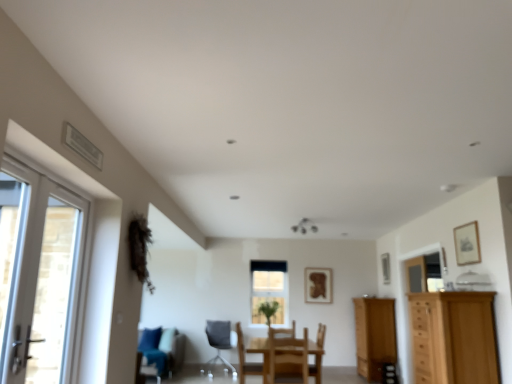
What do you see at coordinates (269, 290) in the screenshot? This screenshot has height=384, width=512. I see `clear glass window at center` at bounding box center [269, 290].

Where is `green leafy plant at center`? green leafy plant at center is located at coordinates (268, 310).

Based on the photo, measure the distance between wooden chair at center, the 3th chair in the back-to-front sequence, and camera.

They are 6.20 meters apart.

You are a GUI agent. You are given a task and a screenshot of the screen. Output one action in this format:
    pyautogui.click(x=<x>, y=<y>)
    Task: Click on the gray fabric chair at center, the first chair viewed from the left
    The image size is (512, 384).
    Given the screenshot: What is the action you would take?
    point(219,341)

Where is `wooden framed picture at center, the 3th picture frame viewed from the right`? This screenshot has height=384, width=512. wooden framed picture at center, the 3th picture frame viewed from the right is located at coordinates (318, 285).

Visually, is light brown wood cabinet at right, which appears as the second cabinetry when viewed from the top, positioned to the left or to the right of wooden picture frame at right, which is the 2th picture frame in front-to-back order?

Clearly, light brown wood cabinet at right, which appears as the second cabinetry when viewed from the top, is on the left of wooden picture frame at right, which is the 2th picture frame in front-to-back order, in the image.

Considering the relative sizes of light brown wood cabinet at right, the first cabinetry viewed from the back, and wooden picture frame at right, the second picture frame positioned from the bottom, in the image provided, is light brown wood cabinet at right, the first cabinetry viewed from the back, taller than wooden picture frame at right, the second picture frame positioned from the bottom,?

Correct, light brown wood cabinet at right, the first cabinetry viewed from the back, is much taller as wooden picture frame at right, the second picture frame positioned from the bottom.

Image resolution: width=512 pixels, height=384 pixels. I want to click on the 2nd cabinetry directly beneath the wooden picture frame at right, which is the 2th picture frame in front-to-back order (from a real-world perspective), so click(374, 336).

From the image's perspective, is light brown wood cabinet at right, acting as the 1th cabinetry starting from the bottom, under wooden picture frame at right, the second picture frame in the top-to-bottom sequence?

Yes, from the image's perspective, light brown wood cabinet at right, acting as the 1th cabinetry starting from the bottom, is below wooden picture frame at right, the second picture frame in the top-to-bottom sequence.

Can you tell me how much wooden chair at center, arranged as the first chair when viewed from the right, and white glossy door at left, the second door positioned from the right, differ in facing direction?

The facing directions of wooden chair at center, arranged as the first chair when viewed from the right, and white glossy door at left, the second door positioned from the right, are 90.8 degrees apart.

Does wooden chair at center, the 3th chair when ordered from left to right, have a greater height compared to white glossy door at left, arranged as the first door when viewed from the top?

In fact, wooden chair at center, the 3th chair when ordered from left to right, may be shorter than white glossy door at left, arranged as the first door when viewed from the top.

Is wooden chair at center, the 3th chair in the back-to-front sequence, next to white glossy door at left, marked as the 1th door in a left-to-right arrangement, and touching it?

No.

Which object is positioned more to the left, wooden chair at center, the 3th chair in the back-to-front sequence, or white glossy door at left, marked as the 2th door in a back-to-front arrangement?

From the viewer's perspective, white glossy door at left, marked as the 2th door in a back-to-front arrangement, appears more on the left side.

Considering the sizes of wooden cabinet at right, placed as the second door when sorted from left to right, and wooden chair at center, which is the second chair in right-to-left order, in the image, is wooden cabinet at right, placed as the second door when sorted from left to right, bigger or smaller than wooden chair at center, which is the second chair in right-to-left order,?

Considering their sizes, wooden cabinet at right, placed as the second door when sorted from left to right, takes up less space than wooden chair at center, which is the second chair in right-to-left order.

Would you say wooden cabinet at right, placed as the 2th door when sorted from front to back, is to the left or to the right of wooden chair at center, which is the 2th chair from front to back, in the picture?

Based on their positions, wooden cabinet at right, placed as the 2th door when sorted from front to back, is located to the right of wooden chair at center, which is the 2th chair from front to back.

Who is shorter, wooden cabinet at right, placed as the 2th door when sorted from front to back, or wooden chair at center, which is the 2th chair from front to back?

Standing shorter between the two is wooden chair at center, which is the 2th chair from front to back.

Is wooden chair at center, the first chair viewed from the front, at the back of wooden framed picture at center, placed as the 1th picture frame when sorted from bottom to top?

That's not correct — wooden framed picture at center, placed as the 1th picture frame when sorted from bottom to top, is not looking away from wooden chair at center, the first chair viewed from the front.

From the image's perspective, which object appears higher, wooden framed picture at center, which ranks as the first picture frame in left-to-right order, or wooden chair at center, the 3th chair when ordered from left to right?

wooden framed picture at center, which ranks as the first picture frame in left-to-right order.

Is wooden framed picture at center, the 3th picture frame from the front, to the left or to the right of wooden chair at center, the 3th chair when ordered from left to right, in the image?

Clearly, wooden framed picture at center, the 3th picture frame from the front, is on the right of wooden chair at center, the 3th chair when ordered from left to right, in the image.

From the picture: Considering the positions of objects clear glass window at center and wooden chair at center, the first chair viewed from the front, in the image provided, who is in front, clear glass window at center or wooden chair at center, the first chair viewed from the front,?

wooden chair at center, the first chair viewed from the front, is closer to the camera.

Does clear glass window at center have a smaller size compared to wooden chair at center, arranged as the first chair when viewed from the right?

Correct, clear glass window at center occupies less space than wooden chair at center, arranged as the first chair when viewed from the right.

Is clear glass window at center oriented towards wooden chair at center, the 3th chair when ordered from left to right?

Yes, clear glass window at center is turned towards wooden chair at center, the 3th chair when ordered from left to right.

From a real-world perspective, relative to wooden chair at center, the first chair viewed from the front, is clear glass window at center vertically above or below?

clear glass window at center is situated higher than wooden chair at center, the first chair viewed from the front, in the real world.

Which of these two, wooden picture frame at right, the second picture frame in the top-to-bottom sequence, or teal fabric swivel chair at lower left, is bigger?

teal fabric swivel chair at lower left.

Is point (389, 275) positioned before point (175, 360)?

No, it is behind (175, 360).

From the image's perspective, between wooden picture frame at right, positioned as the 1th picture frame in right-to-left order, and teal fabric swivel chair at lower left, which one is located above?

From the image's view, wooden picture frame at right, positioned as the 1th picture frame in right-to-left order, is above.

Can we say wooden picture frame at right, positioned as the 1th picture frame in right-to-left order, lies outside teal fabric swivel chair at lower left?

Indeed, wooden picture frame at right, positioned as the 1th picture frame in right-to-left order, is completely outside teal fabric swivel chair at lower left.

Considering the relative sizes of wooden chair at center, which is the second chair in right-to-left order, and green leafy plant at center in the image provided, is wooden chair at center, which is the second chair in right-to-left order, bigger than green leafy plant at center?

Correct, wooden chair at center, which is the second chair in right-to-left order, is larger in size than green leafy plant at center.

Can you confirm if wooden chair at center, which is the second chair in right-to-left order, is wider than green leafy plant at center?

Indeed, wooden chair at center, which is the second chair in right-to-left order, has a greater width compared to green leafy plant at center.

Is wooden chair at center, the second chair when ordered from left to right, far from green leafy plant at center?

That's not correct — wooden chair at center, the second chair when ordered from left to right, is a little close to green leafy plant at center.

Could you tell me if wooden chair at center, marked as the 2th chair in a back-to-front arrangement, is turned towards green leafy plant at center?

No.

You are a GUI agent. You are given a task and a screenshot of the screen. Output one action in this format:
    pyautogui.click(x=<x>, y=<y>)
    Task: Click on the 2nd picture frame directly above the light brown wood cabinet at right, the second cabinetry viewed from the front (from a real-world perspective)
    This screenshot has width=512, height=384.
    Given the screenshot: What is the action you would take?
    pyautogui.click(x=385, y=267)

At what (x,y) coordinates should I click in order to perform the action: click on door that is on the left side of wooden chair at center, arranged as the first chair when viewed from the right. Please return your answer as a coordinate pair (x, y). Image resolution: width=512 pixels, height=384 pixels. Looking at the image, I should click on (42, 279).

Estimate the real-world distances between objects in this image. Which object is closer to light brown wooden cabinet at right, positioned as the 2th cabinetry in back-to-front order, wooden framed picture at center, placed as the 1th picture frame when sorted from bottom to top, or gray fabric chair at center, placed as the third chair when sorted from right to left?

The object closer to light brown wooden cabinet at right, positioned as the 2th cabinetry in back-to-front order, is wooden framed picture at center, placed as the 1th picture frame when sorted from bottom to top.

When comparing their distances from teal fabric swivel chair at lower left, does wooden picture frame at right, the second picture frame in the top-to-bottom sequence, or light brown wooden cabinet at right, positioned as the 2th cabinetry in back-to-front order, seem closer?

Among the two, wooden picture frame at right, the second picture frame in the top-to-bottom sequence, is located nearer to teal fabric swivel chair at lower left.

Looking at the image, which one is located further to wooden cabinet at right, which is counted as the first door, starting from the bottom, gray fabric chair at center, the first chair viewed from the left, or teal fabric swivel chair at lower left?

teal fabric swivel chair at lower left.

Which object lies further to the anchor point wooden picture frame at right, the second picture frame in the top-to-bottom sequence, wooden chair at center, the 3th chair when ordered from left to right, or wooden cabinet at right, which is counted as the first door, starting from the bottom?

Among the two, wooden chair at center, the 3th chair when ordered from left to right, is located further to wooden picture frame at right, the second picture frame in the top-to-bottom sequence.

From the image, which object appears to be nearer to teal fabric swivel chair at lower left, wooden picture frame at right, the 3th picture frame from the left, or clear glass window at center?

Based on the image, clear glass window at center appears to be nearer to teal fabric swivel chair at lower left.

Estimate the real-world distances between objects in this image. Which object is closer to wooden picture frame at right, positioned as the 1th picture frame in right-to-left order, gray fabric chair at center, placed as the third chair when sorted from right to left, or wooden framed picture at center, which ranks as the 1th picture frame in back-to-front order?

Based on the image, wooden framed picture at center, which ranks as the 1th picture frame in back-to-front order, appears to be nearer to wooden picture frame at right, positioned as the 1th picture frame in right-to-left order.

Looking at the image, which one is located further to wooden cabinet at right, the second door in the top-to-bottom sequence, wooden framed picture at center, which ranks as the first picture frame in left-to-right order, or gray fabric chair at center, which ranks as the first chair in back-to-front order?

gray fabric chair at center, which ranks as the first chair in back-to-front order, lies further to wooden cabinet at right, the second door in the top-to-bottom sequence, than the other object.

Based on their spatial positions, is white glossy door at left, marked as the 2th door in a back-to-front arrangement, or teal fabric swivel chair at lower left further from green leafy plant at center?

white glossy door at left, marked as the 2th door in a back-to-front arrangement, lies further to green leafy plant at center than the other object.

What are the coordinates of `door positioned between white glossy door at left, arranged as the first door when viewed from the top, and green leafy plant at center from near to far` in the screenshot? It's located at (416, 275).

At what (x,y) coordinates should I click in order to perform the action: click on window between gray fabric chair at center, acting as the 3th chair starting from the front, and wooden framed picture at center, the 3th picture frame positioned from the top. Please return your answer as a coordinate pair (x, y). Looking at the image, I should click on [269, 290].

Locate an element on the screen. swivel chair positioned between white glossy door at left, marked as the 2th door in a back-to-front arrangement, and wooden framed picture at center, placed as the 1th picture frame when sorted from bottom to top, from near to far is located at coordinates (164, 355).

This screenshot has height=384, width=512. I want to click on picture frame positioned between wooden chair at center, which is the second chair in right-to-left order, and green leafy plant at center from near to far, so [385, 267].